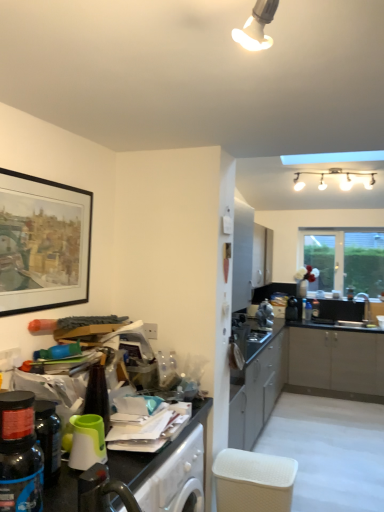
Question: Does green plastic cup at lower left, marked as the first appliance in a left-to-right arrangement, lie in front of black plastic toaster at center-right, the 1th appliance when ordered from right to left?

Choices:
 (A) no
 (B) yes

Answer: (B)

Question: Does green plastic cup at lower left, arranged as the 1th appliance when viewed from the front, have a lesser width compared to black plastic toaster at center-right, positioned as the 3th appliance in left-to-right order?

Choices:
 (A) yes
 (B) no

Answer: (A)

Question: Is green plastic cup at lower left, marked as the first appliance in a left-to-right arrangement, located outside black plastic toaster at center-right, positioned as the 3th appliance in left-to-right order?

Choices:
 (A) yes
 (B) no

Answer: (A)

Question: From the image's perspective, is green plastic cup at lower left, placed as the third appliance when sorted from back to front, below black plastic toaster at center-right, which is the 1th appliance in back-to-front order?

Choices:
 (A) yes
 (B) no

Answer: (B)

Question: Is green plastic cup at lower left, marked as the first appliance in a left-to-right arrangement, facing towards black plastic toaster at center-right, the 3th appliance when ordered from front to back?

Choices:
 (A) yes
 (B) no

Answer: (B)

Question: Is green plastic cup at lower left, the third appliance positioned from the right, smaller than black plastic toaster at center-right, the 3th appliance when ordered from front to back?

Choices:
 (A) yes
 (B) no

Answer: (A)

Question: Does green plastic cup at lower left, placed as the third appliance when sorted from back to front, appear on the right side of white textured basket at lower center?

Choices:
 (A) yes
 (B) no

Answer: (B)

Question: From a real-world perspective, is green plastic cup at lower left, arranged as the 1th appliance when viewed from the front, beneath white textured basket at lower center?

Choices:
 (A) yes
 (B) no

Answer: (B)

Question: Can you confirm if green plastic cup at lower left, arranged as the 1th appliance when viewed from the front, is bigger than white textured basket at lower center?

Choices:
 (A) yes
 (B) no

Answer: (B)

Question: Does green plastic cup at lower left, arranged as the 1th appliance when viewed from the front, have a lesser width compared to white textured basket at lower center?

Choices:
 (A) yes
 (B) no

Answer: (A)

Question: Is white textured basket at lower center at the back of green plastic cup at lower left, the third appliance positioned from the right?

Choices:
 (A) yes
 (B) no

Answer: (B)

Question: Is green plastic cup at lower left, arranged as the 1th appliance when viewed from the front, positioned in front of white textured basket at lower center?

Choices:
 (A) no
 (B) yes

Answer: (B)

Question: Is white textured basket at lower center oriented towards black plastic toaster at center-right, the 1th appliance when ordered from right to left?

Choices:
 (A) no
 (B) yes

Answer: (A)